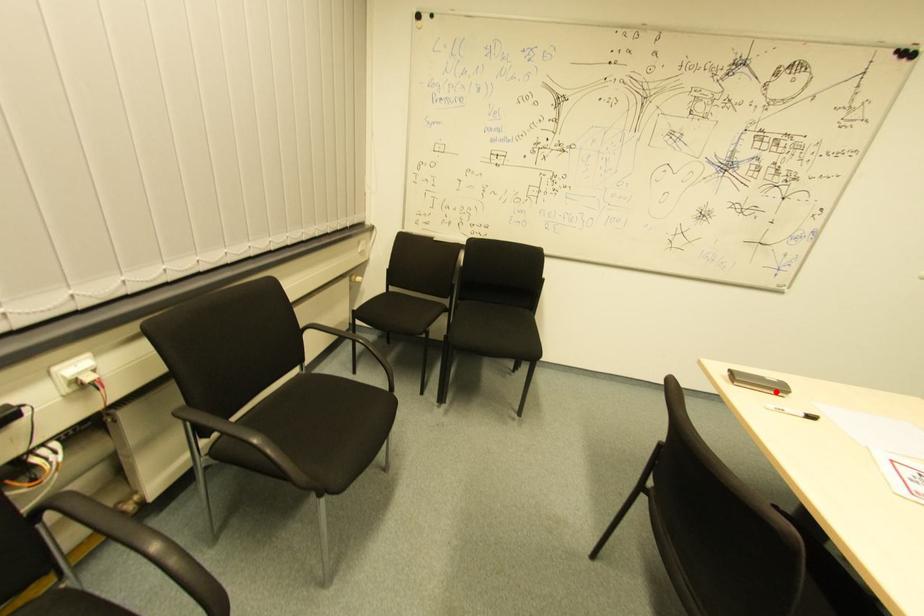
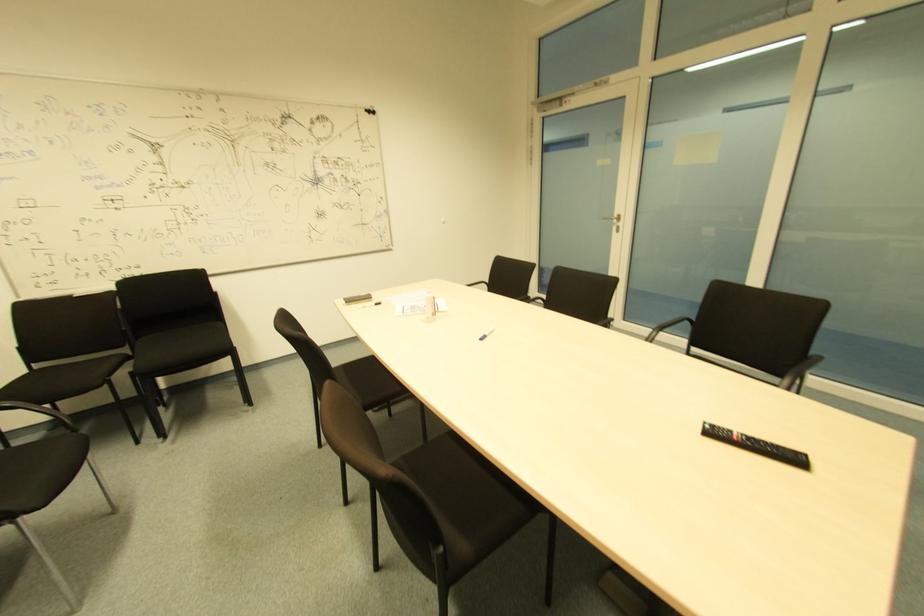
Find the pixel in the second image that matches the highlighted location in the first image.

(365, 301)